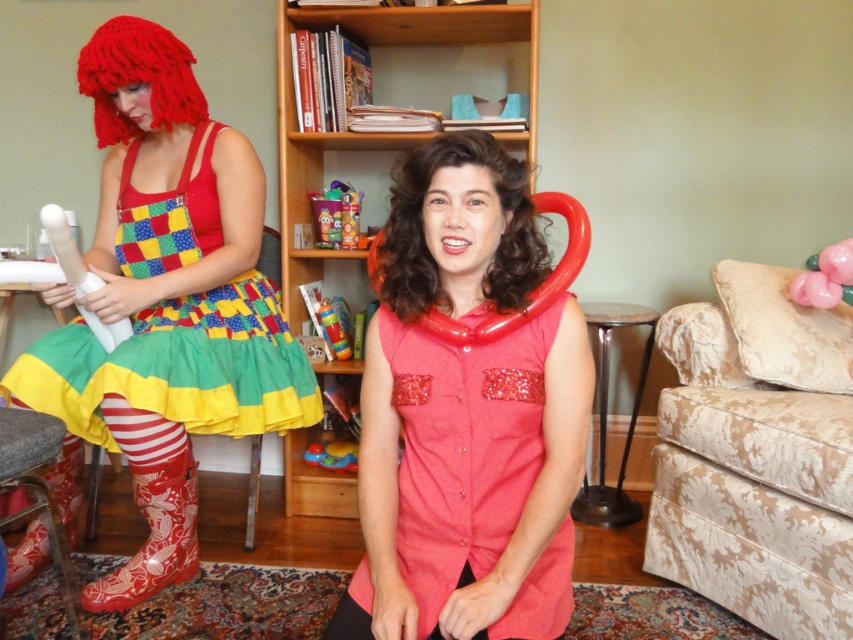
Question: Is red rubber boot at lower left to the left of plastic toy at center from the viewer's perspective?

Choices:
 (A) no
 (B) yes

Answer: (B)

Question: Does plastic toy at center appear on the left side of rubberized plastic cup at center?

Choices:
 (A) no
 (B) yes

Answer: (A)

Question: Among these objects, which one is farthest from the camera?

Choices:
 (A) matte rubber boots at left
 (B) pink rubber toy at upper right
 (C) curly brown hair at center
 (D) rubber boot at lower left

Answer: (B)

Question: Which object appears farthest from the camera in this image?

Choices:
 (A) velvet beige armchair at right
 (B) matte red blouse at center
 (C) rubber boot at lower left
 (D) plastic toy at center

Answer: (D)

Question: Among these points, which one is nearest to the camera?

Choices:
 (A) (354, 198)
 (B) (793, 419)
 (C) (828, 275)
 (D) (357, 465)

Answer: (B)

Question: Is curly brown hair at center thinner than rubber duck at center?

Choices:
 (A) no
 (B) yes

Answer: (A)